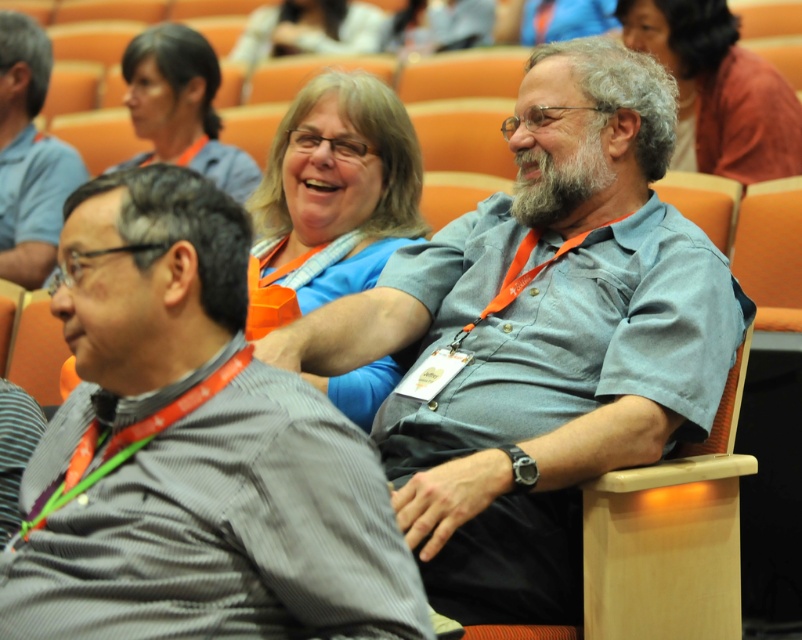
Image resolution: width=802 pixels, height=640 pixels. What are the coordinates of `gray striped shirt at center` in the screenshot? It's located at (193, 451).

Identify the location of gray striped shirt at center. Image resolution: width=802 pixels, height=640 pixels. (193, 451).

Between gray cotton shirt at center and matte orange lanyard at upper center, which one appears on the left side from the viewer's perspective?

Positioned to the left is matte orange lanyard at upper center.

Can you confirm if gray cotton shirt at center is thinner than matte orange lanyard at upper center?

In fact, gray cotton shirt at center might be wider than matte orange lanyard at upper center.

Does point (410, 330) come behind point (124, 72)?

No, it is in front of (124, 72).

Where is `gray cotton shirt at center`? This screenshot has height=640, width=802. gray cotton shirt at center is located at coordinates (541, 339).

Is gray cotton shirt at center positioned before matte blue shirt at upper center?

Yes, it is in front of matte blue shirt at upper center.

Does gray cotton shirt at center appear under matte blue shirt at upper center?

Correct, gray cotton shirt at center is located below matte blue shirt at upper center.

Which is behind, point (588, 301) or point (349, 51)?

The point (349, 51) is behind.

Where is `gray cotton shirt at center`? gray cotton shirt at center is located at coordinates (541, 339).